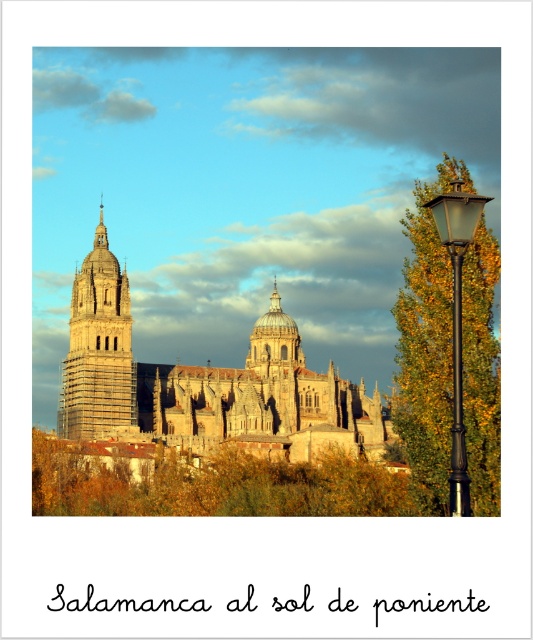
Question: Which object is the closest to the yellow-green foliage at center?

Choices:
 (A) stone gothic cathedral at center
 (B) black metal lamp post at right

Answer: (A)

Question: Which object appears farthest from the camera in this image?

Choices:
 (A) yellow-green foliage at center
 (B) black metal lamp post at right

Answer: (A)

Question: Can you confirm if stone gothic cathedral at center is positioned below black metal lamp post at right?

Choices:
 (A) yes
 (B) no

Answer: (A)

Question: Among these points, which one is nearest to the camera?

Choices:
 (A) (319, 451)
 (B) (100, 273)

Answer: (A)

Question: Is stone gothic cathedral at center above yellow-green foliage at center?

Choices:
 (A) no
 (B) yes

Answer: (B)

Question: Is yellow-green foliage at center wider than stone tower at center?

Choices:
 (A) no
 (B) yes

Answer: (B)